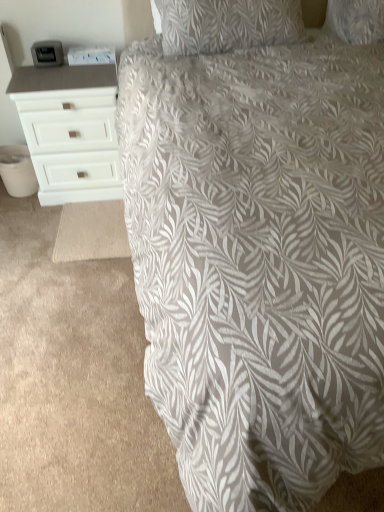
Question: From a real-world perspective, is white matte chest of drawers at left positioned above or below gray leaf-patterned fabric at center?

Choices:
 (A) below
 (B) above

Answer: (B)

Question: In terms of size, does white matte chest of drawers at left appear bigger or smaller than gray leaf-patterned fabric at center?

Choices:
 (A) big
 (B) small

Answer: (B)

Question: In terms of height, does white matte chest of drawers at left look taller or shorter compared to gray leaf-patterned fabric at center?

Choices:
 (A) short
 (B) tall

Answer: (B)

Question: In terms of width, does gray leaf-patterned fabric at center look wider or thinner when compared to white matte chest of drawers at left?

Choices:
 (A) wide
 (B) thin

Answer: (A)

Question: Is gray leaf-patterned fabric at center inside or outside of white matte chest of drawers at left?

Choices:
 (A) outside
 (B) inside

Answer: (A)

Question: Considering the positions of point (168, 331) and point (72, 110), is point (168, 331) closer or farther from the camera than point (72, 110)?

Choices:
 (A) closer
 (B) farther

Answer: (A)

Question: Visually, is gray leaf-patterned fabric at center positioned to the left or to the right of white matte chest of drawers at left?

Choices:
 (A) left
 (B) right

Answer: (B)